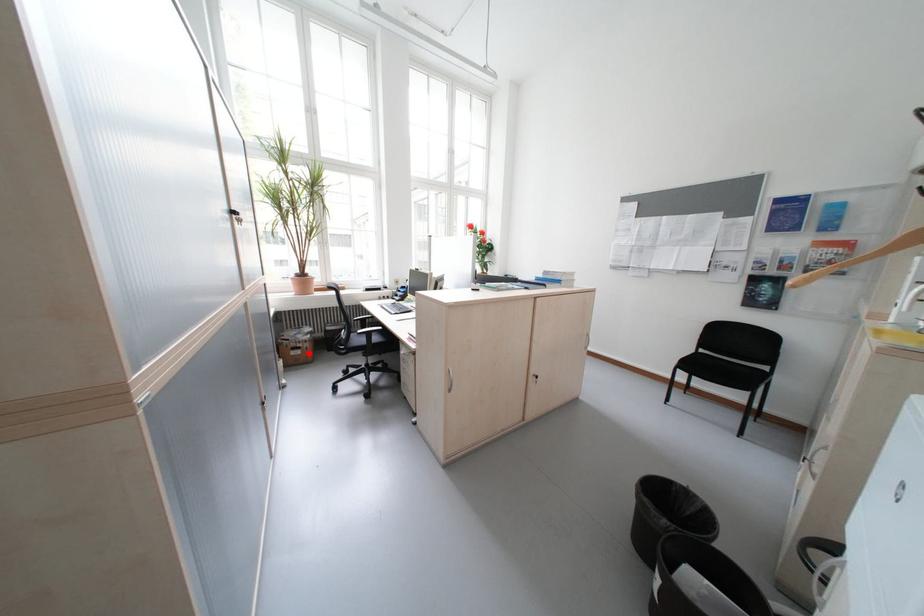
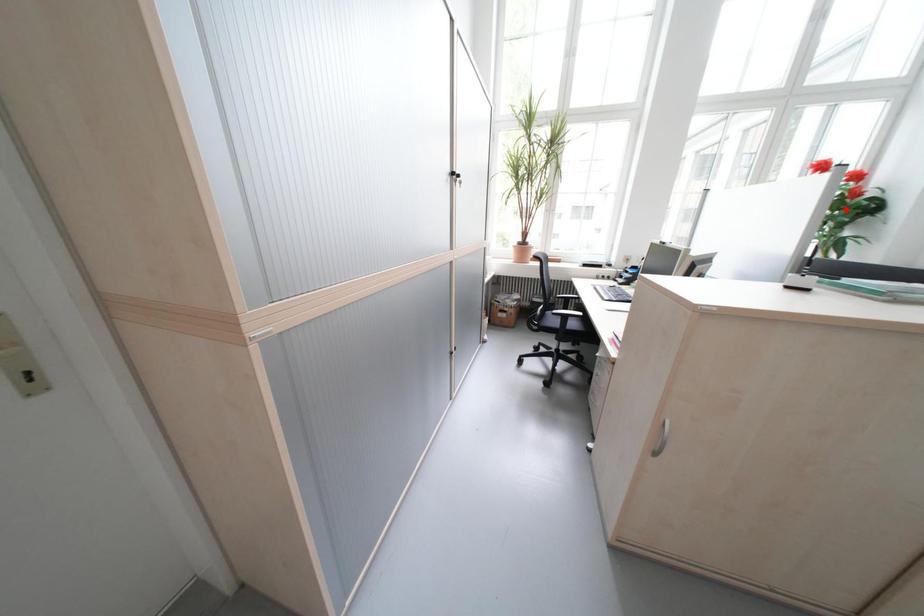
I am providing you with two images of the same scene from different viewpoints. A red point is marked on the first image and another point is marked on the second image. Is the red point in image1 aligned with the point shown in image2?

No